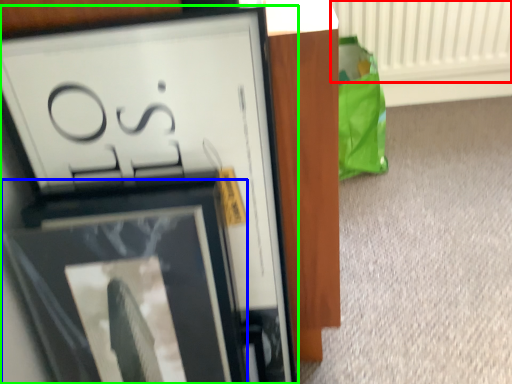
Question: Which is nearer to the radiator (highlighted by a red box)? picture frame (highlighted by a blue box) or picture frame (highlighted by a green box).

Choices:
 (A) picture frame
 (B) picture frame

Answer: (B)